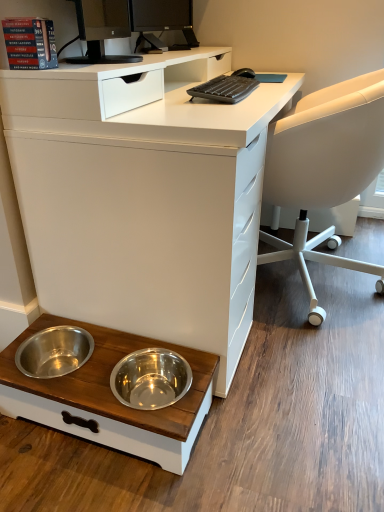
The height and width of the screenshot is (512, 384). I want to click on free space in front of white plastic chair at right, so click(x=311, y=382).